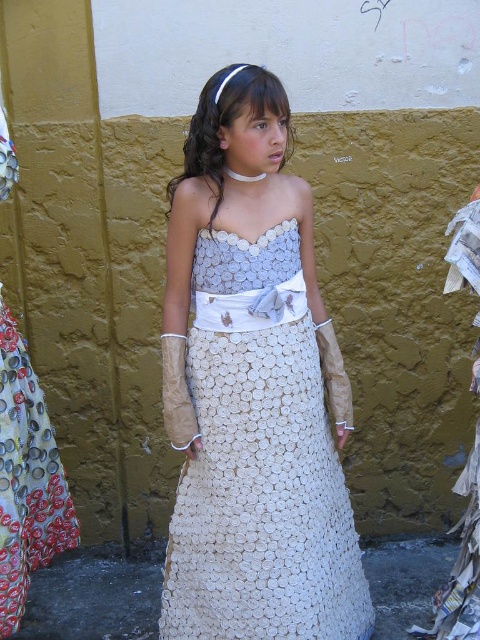
Question: Which object is closer to the camera taking this photo?

Choices:
 (A) white textured fabric dress at center
 (B) white textured dress at center

Answer: (B)

Question: Is white textured dress at center to the right of white textured fabric dress at center from the viewer's perspective?

Choices:
 (A) yes
 (B) no

Answer: (A)

Question: Observing the image, what is the correct spatial positioning of white textured dress at center in reference to white textured fabric dress at center?

Choices:
 (A) below
 (B) above

Answer: (B)

Question: Which of the following is the farthest from the observer?

Choices:
 (A) white textured fabric dress at center
 (B) white textured dress at center

Answer: (A)

Question: Is white textured dress at center to the right of white textured fabric dress at center from the viewer's perspective?

Choices:
 (A) yes
 (B) no

Answer: (A)